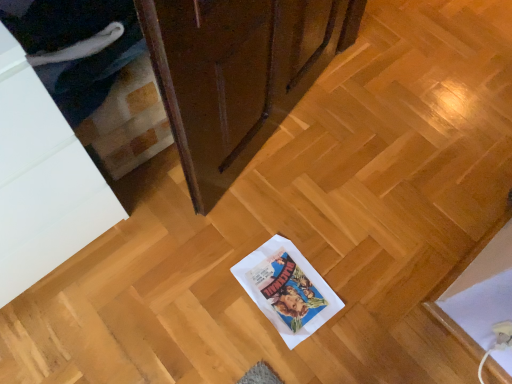
Identify the location of vacant area located to the right-hand side of matte brown cabinet at upper center, the 2th cabinetry from the left. (361, 158).